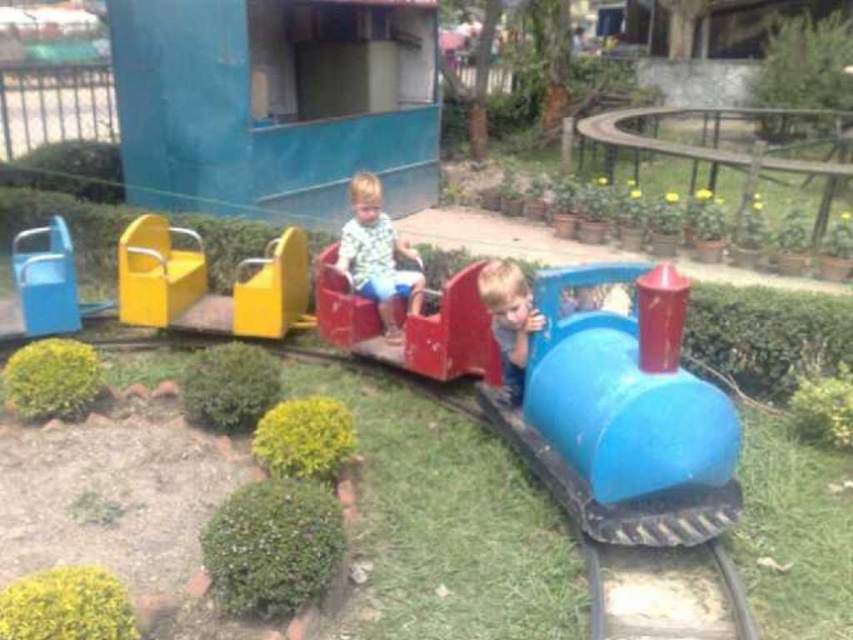
Question: Does matte green shirt at center appear over smooth blue train at center?

Choices:
 (A) yes
 (B) no

Answer: (A)

Question: Among these points, which one is farthest from the camera?

Choices:
 (A) (357, 272)
 (B) (612, 432)
 (C) (741, 620)
 (D) (524, 291)

Answer: (A)

Question: In this image, where is blue plastic train at center located relative to metallic yellow seat at left?

Choices:
 (A) above
 (B) below

Answer: (B)

Question: Among these points, which one is nearest to the camera?

Choices:
 (A) (149, 220)
 (B) (380, 240)
 (C) (660, 573)

Answer: (C)

Question: Estimate the real-world distances between objects in this image. Which object is closer to the smooth blue train at center?

Choices:
 (A) blue plastic train at center
 (B) black rubber train track at lower center
 (C) matte green shirt at center
 (D) metallic yellow seat at left

Answer: (A)

Question: Can you confirm if black rubber train track at lower center is positioned above smooth blue train at center?

Choices:
 (A) yes
 (B) no

Answer: (B)